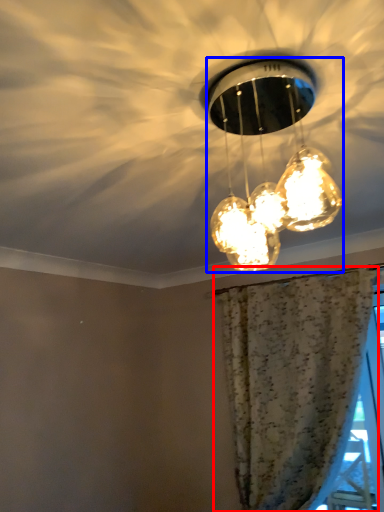
Question: Among these objects, which one is nearest to the camera, curtain (highlighted by a red box) or lamp (highlighted by a blue box)?

Choices:
 (A) curtain
 (B) lamp

Answer: (B)